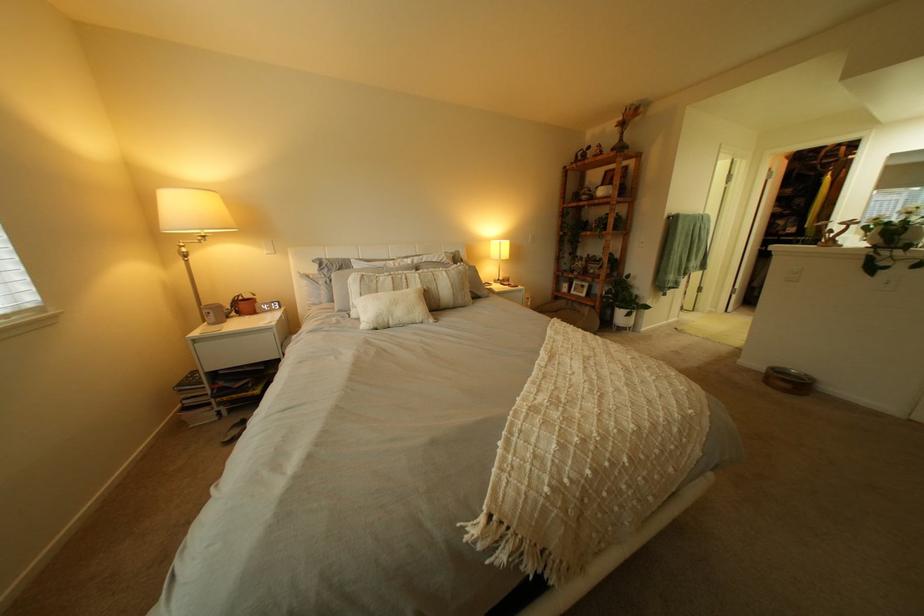
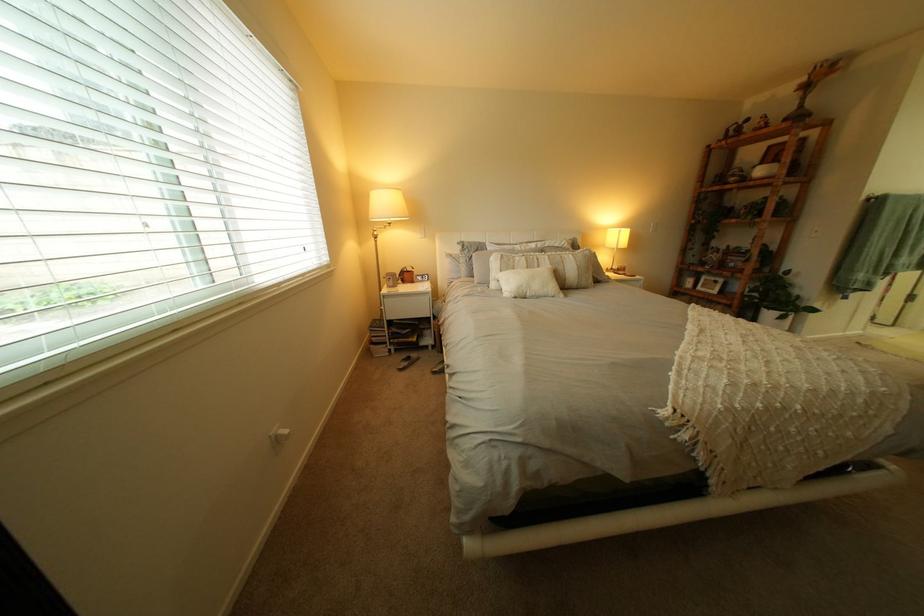
Question: The camera is either moving clockwise (left) or counter-clockwise (right) around the object. The first image is from the beginning of the video and the second image is from the end. Is the camera moving left or right when shooting the video?

Choices:
 (A) Left
 (B) Right

Answer: (B)